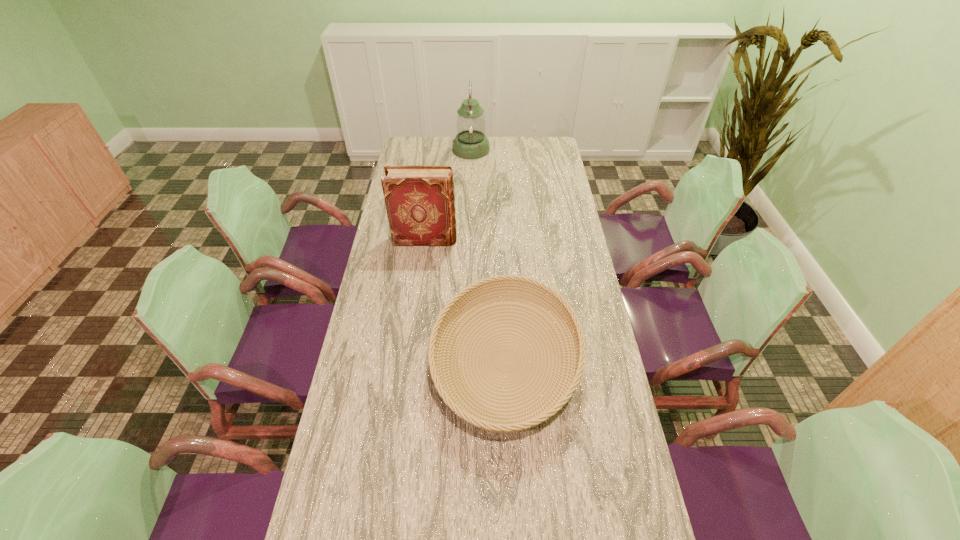
Identify the location of blank area in the image that satisfies the following two spatial constraints: 1. on the spine side of the second farthest object; 2. on the left side of the basket. (410, 361).

At what (x,y) coordinates should I click in order to perform the action: click on free location that satisfies the following two spatial constraints: 1. on the spine side of the hardback book; 2. on the left side of the nearest object. Please return your answer as a coordinate pair (x, y). Looking at the image, I should click on (410, 361).

At what (x,y) coordinates should I click in order to perform the action: click on vacant area that satisfies the following two spatial constraints: 1. on the front side of the lantern; 2. on the spine side of the hardback book. Please return your answer as a coordinate pair (x, y). The width and height of the screenshot is (960, 540). Looking at the image, I should click on (468, 240).